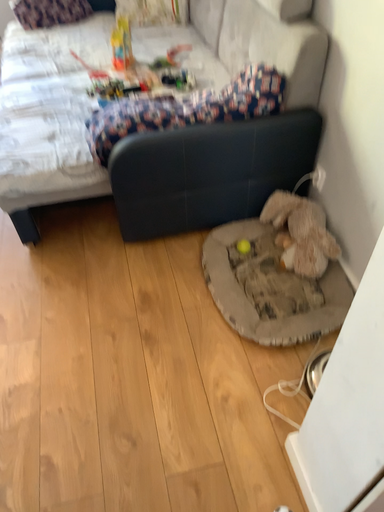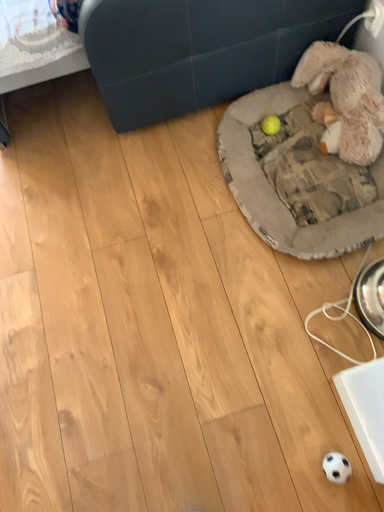
Question: How did the camera likely rotate when shooting the video?

Choices:
 (A) rotated downward
 (B) rotated upward

Answer: (A)